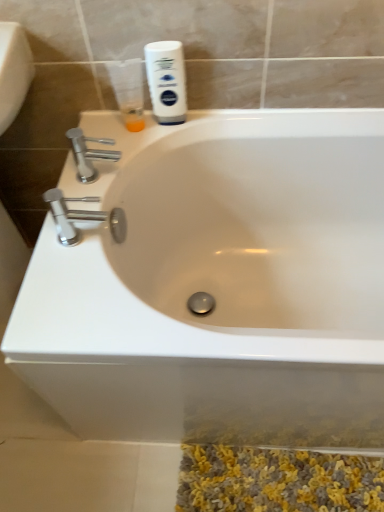
Where is `vacant space in front of translucent plastic cup at upper left`? The width and height of the screenshot is (384, 512). vacant space in front of translucent plastic cup at upper left is located at coordinates (127, 149).